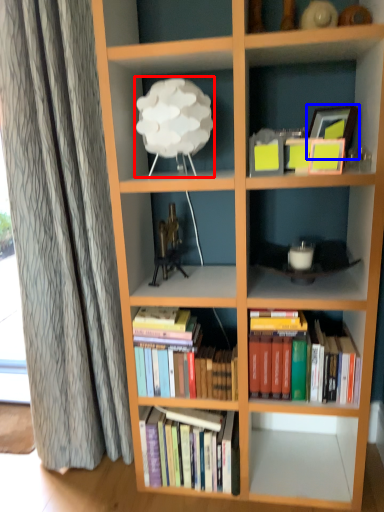
Question: Which of the following is the closest to the observer, lamp (highlighted by a red box) or picture frame (highlighted by a blue box)?

Choices:
 (A) lamp
 (B) picture frame

Answer: (A)